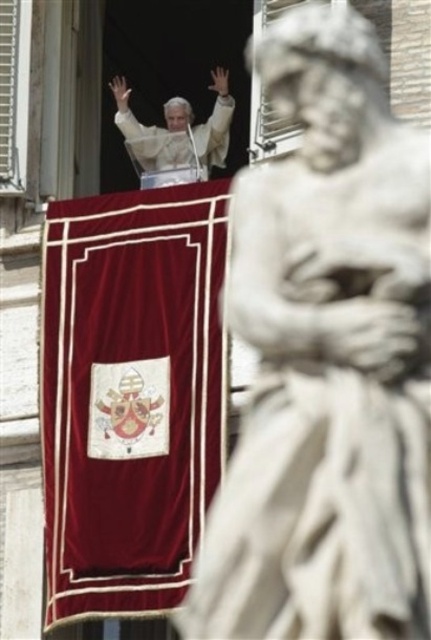
Which of these two, white marble statue at center or velvet red curtain at center, stands shorter?

With less height is velvet red curtain at center.

At what (x,y) coordinates should I click in order to perform the action: click on white marble statue at center. Please return your answer as a coordinate pair (x, y). Image resolution: width=431 pixels, height=640 pixels. Looking at the image, I should click on (327, 358).

Is point (228, 536) less distant than point (190, 138)?

Yes, it is.

Can you confirm if white marble statue at center is smaller than white marble statue at upper center?

No, white marble statue at center is not smaller than white marble statue at upper center.

What are the coordinates of `white marble statue at center` in the screenshot? It's located at (327, 358).

Is velvet red curtain at center to the right of white marble statue at upper center from the viewer's perspective?

No, velvet red curtain at center is not to the right of white marble statue at upper center.

Is point (140, 547) more distant than point (178, 148)?

That is False.

At what (x,y) coordinates should I click in order to perform the action: click on velvet red curtain at center. Please return your answer as a coordinate pair (x, y). Looking at the image, I should click on coord(130,394).